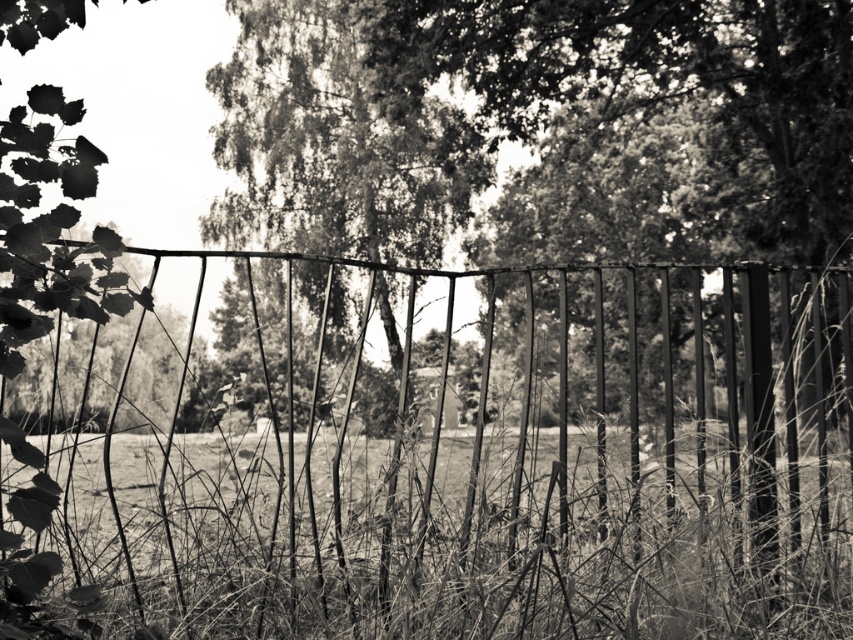
Question: Which of the following is the farthest from the observer?

Choices:
 (A) (244, 604)
 (B) (426, 237)

Answer: (B)

Question: Is grainy textured grass at center to the right of thick textured foliage at center from the viewer's perspective?

Choices:
 (A) no
 (B) yes

Answer: (A)

Question: Among these objects, which one is farthest from the camera?

Choices:
 (A) grainy textured grass at center
 (B) thick textured foliage at center

Answer: (B)

Question: Observing the image, what is the correct spatial positioning of grainy textured grass at center in reference to thick textured foliage at center?

Choices:
 (A) below
 (B) above

Answer: (A)

Question: Can you confirm if grainy textured grass at center is wider than thick textured foliage at center?

Choices:
 (A) no
 (B) yes

Answer: (B)